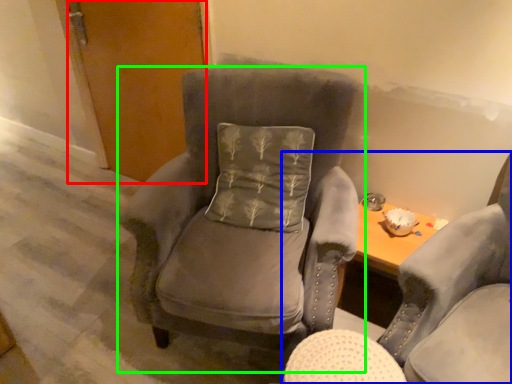
Question: Which object is the closest to the door (highlighted by a red box)? Choose among these: chair (highlighted by a blue box) or chair (highlighted by a green box).

Choices:
 (A) chair
 (B) chair

Answer: (B)